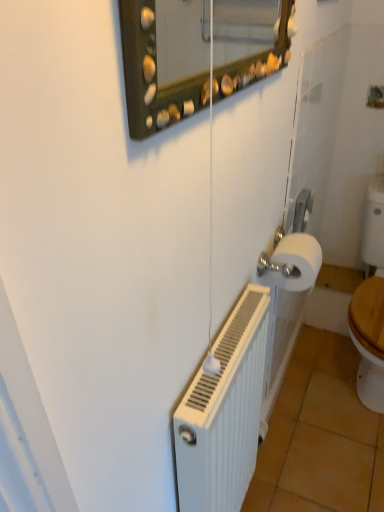
At what (x,y) coordinates should I click in order to perform the action: click on blank space situated above white ribbed radiator at lower right (from a real-world perspective). Please return your answer as a coordinate pair (x, y). Image resolution: width=384 pixels, height=512 pixels. Looking at the image, I should click on (231, 336).